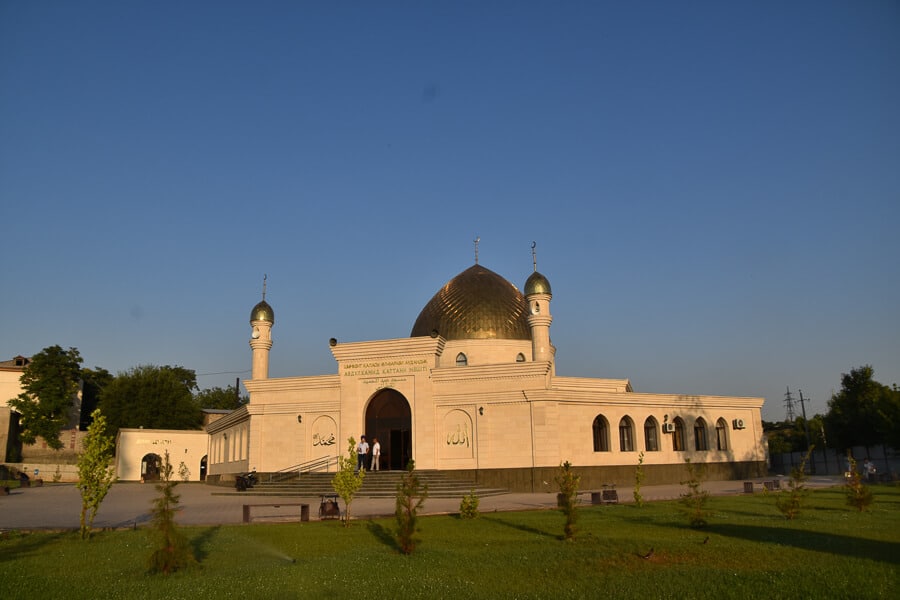
In order to click on bench in this screenshot , I will do `click(281, 506)`, `click(592, 492)`, `click(760, 483)`.